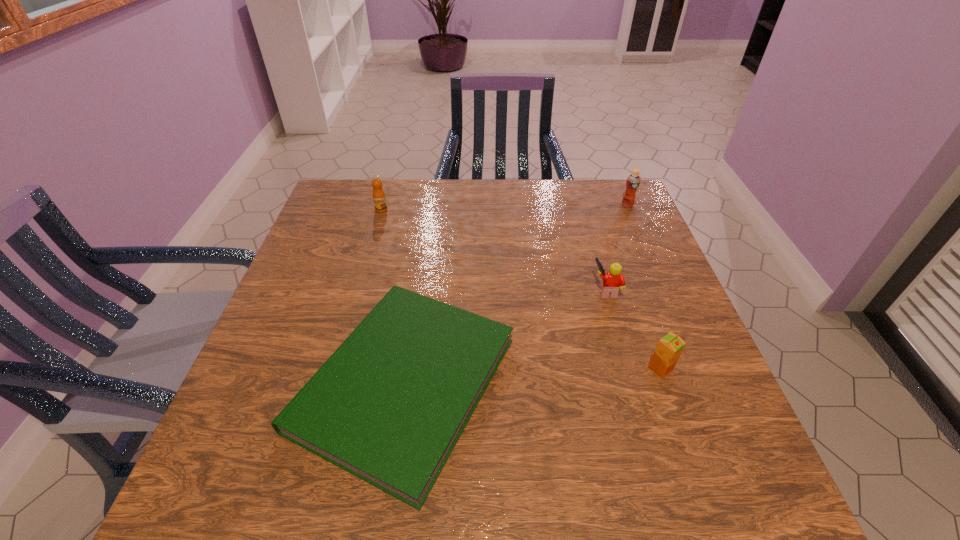
What are the coordinates of `free space between the Lego and the second orange juice from left to right` in the screenshot? It's located at (634, 329).

Identify the location of vacant space in between the third object from right to left and the second object from right to left. Image resolution: width=960 pixels, height=540 pixels. (634, 329).

Identify the location of unoccupied position between the second orange juice from right to left and the rightmost orange juice. (644, 287).

What are the coordinates of `the closest object to the Lego` in the screenshot? It's located at (669, 348).

Select which object appears as the second closest to the rightmost object. Please provide its 2D coordinates. Your answer should be formatted as a tuple, i.e. [(x, y)], where the tuple contains the x and y coordinates of a point satisfying the conditions above.

[(389, 405)]

Locate an element on the screen. The image size is (960, 540). orange juice that is the closest to the leftmost orange juice is located at coordinates (633, 181).

Find the location of a particular element. orange juice object that ranks as the second closest to the paperback book is located at coordinates (379, 198).

What are the coordinates of `vacant point that satisfies the following two spatial constraints: 1. on the back side of the shortest object; 2. on the left side of the rightmost object` in the screenshot? It's located at (430, 205).

Identify the location of vacant space that satisfies the following two spatial constraints: 1. on the back side of the shortest object; 2. on the right side of the rightmost orange juice. The height and width of the screenshot is (540, 960). (430, 205).

At what (x,y) coordinates should I click in order to perform the action: click on free location that satisfies the following two spatial constraints: 1. in front of the Lego with the accessory visible; 2. on the left side of the nearest orange juice. Please return your answer as a coordinate pair (x, y). This screenshot has height=540, width=960. Looking at the image, I should click on (630, 369).